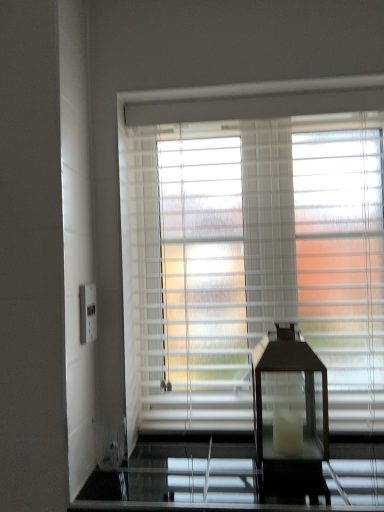
This screenshot has height=512, width=384. What do you see at coordinates (88, 313) in the screenshot? I see `white plastic electric outlet at left` at bounding box center [88, 313].

Locate an element on the screen. The image size is (384, 512). white textured blinds at center is located at coordinates (251, 251).

Is black glass table lamp at center further to the viewer compared to white plastic electric outlet at left?

No, black glass table lamp at center is closer to the viewer.

From the image's perspective, does black glass table lamp at center appear higher than white plastic electric outlet at left?

Incorrect, from the image's perspective, black glass table lamp at center is lower than white plastic electric outlet at left.

Would you say black glass table lamp at center is a long distance from white plastic electric outlet at left?

No.

Is black glass table lamp at center inside the boundaries of white plastic electric outlet at left, or outside?

black glass table lamp at center is spatially situated outside white plastic electric outlet at left.

Considering the sizes of objects black glass table lamp at center and white textured blinds at center in the image provided, who is taller, black glass table lamp at center or white textured blinds at center?

Standing taller between the two is white textured blinds at center.

In the image, is black glass table lamp at center positioned in front of or behind white textured blinds at center?

In the image, black glass table lamp at center appears in front of white textured blinds at center.

Is black glass table lamp at center inside the boundaries of white textured blinds at center, or outside?

black glass table lamp at center lies outside white textured blinds at center.

How distant is white plastic electric outlet at left from white textured blinds at center?

white plastic electric outlet at left is 20.36 inches from white textured blinds at center.

Is white plastic electric outlet at left next to white textured blinds at center and touching it?

They are not placed beside each other.

Is white plastic electric outlet at left positioned with its back to white textured blinds at center?

No, white textured blinds at center is not at the back of white plastic electric outlet at left.

Considering the relative sizes of white plastic electric outlet at left and white textured blinds at center in the image provided, is white plastic electric outlet at left bigger than white textured blinds at center?

Incorrect, white plastic electric outlet at left is not larger than white textured blinds at center.

Image resolution: width=384 pixels, height=512 pixels. Find the location of `window blind above the black glass table lamp at center (from a real-world perspective)`. window blind above the black glass table lamp at center (from a real-world perspective) is located at coordinates (251, 251).

From a real-world perspective, is white textured blinds at center above or below black glass table lamp at center?

From a real-world perspective, white textured blinds at center is physically above black glass table lamp at center.

Which is less distant, (349, 365) or (306, 464)?

Positioned in front is point (306, 464).

Who is smaller, white textured blinds at center or black glass table lamp at center?

black glass table lamp at center.

Is point (283, 268) farther from camera compared to point (90, 290)?

That is True.

Is the position of white textured blinds at center less distant than that of white plastic electric outlet at left?

No, it is behind white plastic electric outlet at left.

Is white textured blinds at center positioned with its back to white plastic electric outlet at left?

white textured blinds at center is not turned away from white plastic electric outlet at left.

Is white textured blinds at center placed right next to white plastic electric outlet at left?

No, white textured blinds at center is not next to white plastic electric outlet at left.

From the image's perspective, would you say white plastic electric outlet at left is shown under black glass table lamp at center?

Actually, white plastic electric outlet at left appears above black glass table lamp at center in the image.

Are white plastic electric outlet at left and black glass table lamp at center located far from each other?

white plastic electric outlet at left is actually quite close to black glass table lamp at center.

Considering their positions, is white plastic electric outlet at left located in front of or behind black glass table lamp at center?

Visually, white plastic electric outlet at left is located behind black glass table lamp at center.

Is white plastic electric outlet at left located outside black glass table lamp at center?

Indeed, white plastic electric outlet at left is completely outside black glass table lamp at center.

Identify the location of electric outlet that is on the left side of black glass table lamp at center. (88, 313).

The height and width of the screenshot is (512, 384). Identify the location of table lamp on the right side of white textured blinds at center. (290, 415).

Looking at the image, which one is located closer to white textured blinds at center, white plastic electric outlet at left or black glass table lamp at center?

The object closer to white textured blinds at center is black glass table lamp at center.

Looking at the image, which one is located further to white plastic electric outlet at left, black glass table lamp at center or white textured blinds at center?

Based on the image, black glass table lamp at center appears to be further to white plastic electric outlet at left.

When comparing their distances from white plastic electric outlet at left, does white textured blinds at center or black glass table lamp at center seem closer?

Among the two, white textured blinds at center is located nearer to white plastic electric outlet at left.

Considering their positions, is white textured blinds at center positioned closer to black glass table lamp at center than white plastic electric outlet at left?

white textured blinds at center is closer to black glass table lamp at center.

Estimate the real-world distances between objects in this image. Which object is closer to black glass table lamp at center, white plastic electric outlet at left or white textured blinds at center?

white textured blinds at center lies closer to black glass table lamp at center than the other object.

When comparing their distances from white textured blinds at center, does black glass table lamp at center or white plastic electric outlet at left seem closer?

black glass table lamp at center is positioned closer to the anchor white textured blinds at center.

You are a GUI agent. You are given a task and a screenshot of the screen. Output one action in this format:
    pyautogui.click(x=<x>, y=<y>)
    Task: Click on the window blind located between white plastic electric outlet at left and black glass table lamp at center in the left-right direction
    
    Given the screenshot: What is the action you would take?
    pyautogui.click(x=251, y=251)